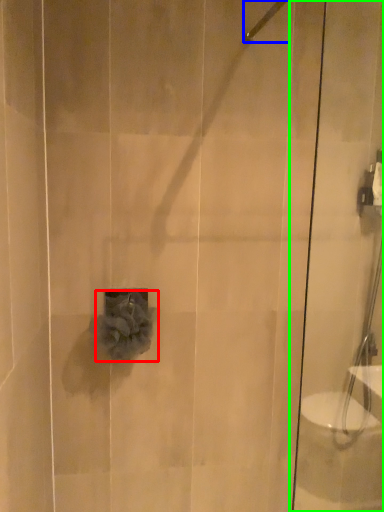
Question: Considering the real-world distances, which object is farthest from flower (highlighted by a red box)? shower (highlighted by a blue box) or shower door (highlighted by a green box)?

Choices:
 (A) shower
 (B) shower door

Answer: (A)